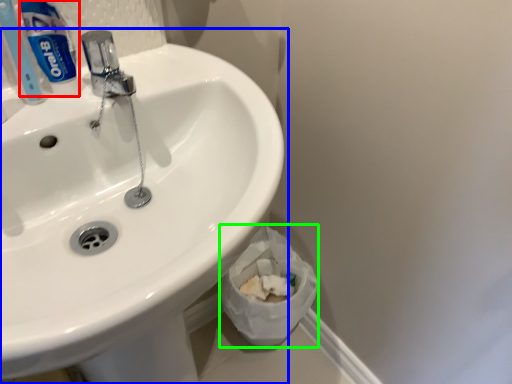
Question: Which object is the closest to the toothpaste (highlighted by a red box)? Choose among these: sink (highlighted by a blue box) or toilet paper (highlighted by a green box).

Choices:
 (A) sink
 (B) toilet paper

Answer: (A)